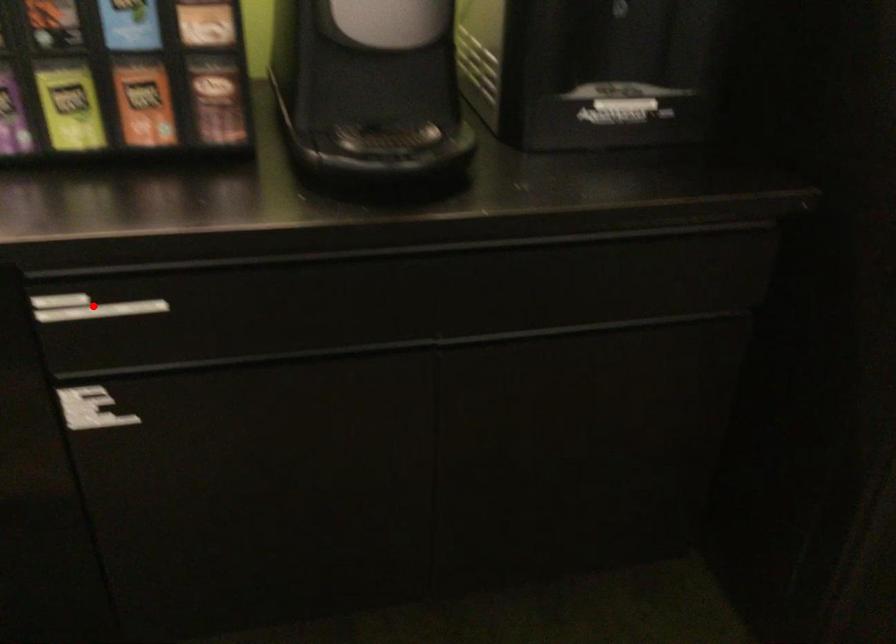
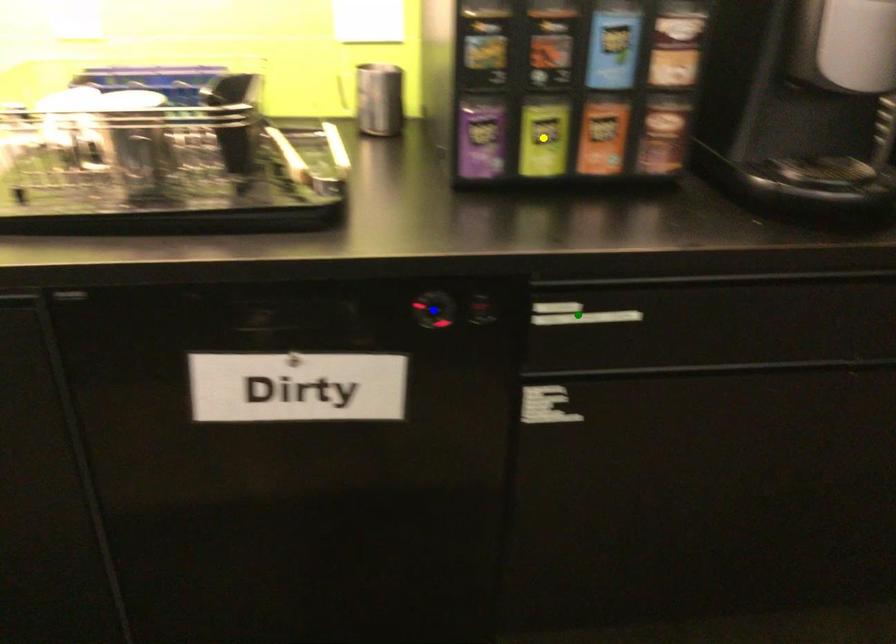
Question: I am providing you with two images of the same scene from different viewpoints. A red point is marked on the first image. You are given multiple points on the second image. Which mark in image 2 goes with the point in image 1?

Choices:
 (A) green point
 (B) blue point
 (C) yellow point

Answer: (A)